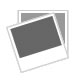
In order to click on corner in this screenshot , I will do `click(6, 27)`.